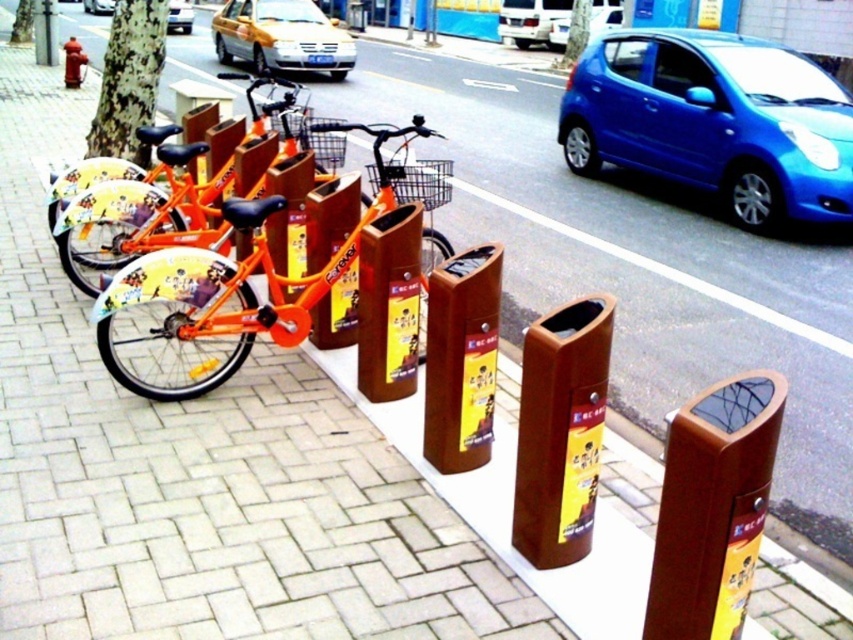
How far apart are orange matte bicycle at left and wooden trash can at center?

orange matte bicycle at left is 5.95 feet from wooden trash can at center.

Between orange matte bicycle at left and wooden trash can at center, which one has more height?

With more height is orange matte bicycle at left.

Image resolution: width=853 pixels, height=640 pixels. What are the coordinates of `orange matte bicycle at left` in the screenshot? It's located at coord(247,276).

Who is more forward, (x=683, y=145) or (x=305, y=49)?

Point (x=683, y=145)

Does blue glossy hatchback at upper right have a greater height compared to yellow metallic taxi at upper center?

Yes, blue glossy hatchback at upper right is taller than yellow metallic taxi at upper center.

Describe the element at coordinates (714, 122) in the screenshot. I see `blue glossy hatchback at upper right` at that location.

The height and width of the screenshot is (640, 853). I want to click on blue glossy hatchback at upper right, so click(714, 122).

Between blue glossy hatchback at upper right and metallic gold car at center, which one is positioned lower?

blue glossy hatchback at upper right is lower down.

Is blue glossy hatchback at upper right shorter than metallic gold car at center?

No.

Between point (769, 160) and point (112, 12), which one is positioned behind?

The point (112, 12) is more distant.

The image size is (853, 640). In order to click on blue glossy hatchback at upper right in this screenshot , I will do `click(714, 122)`.